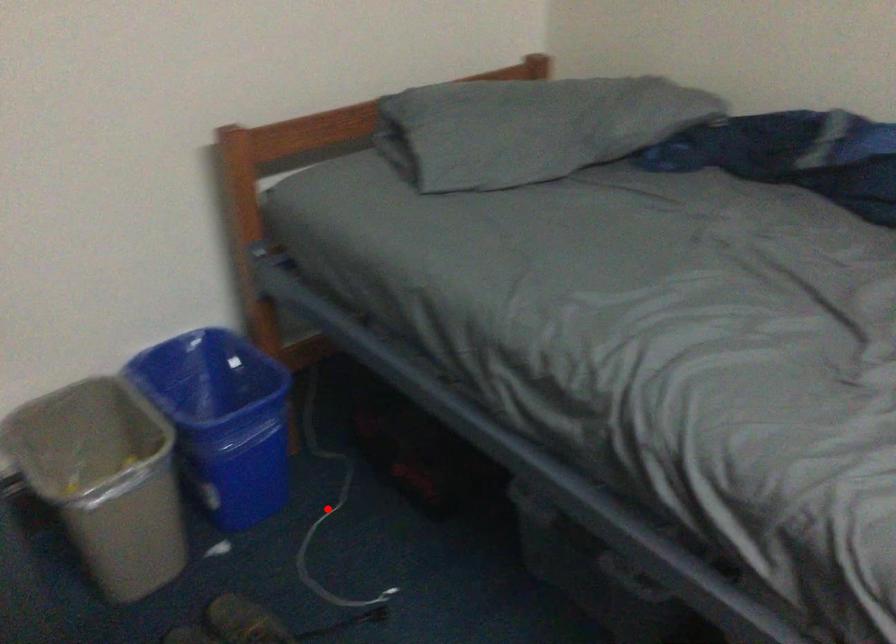
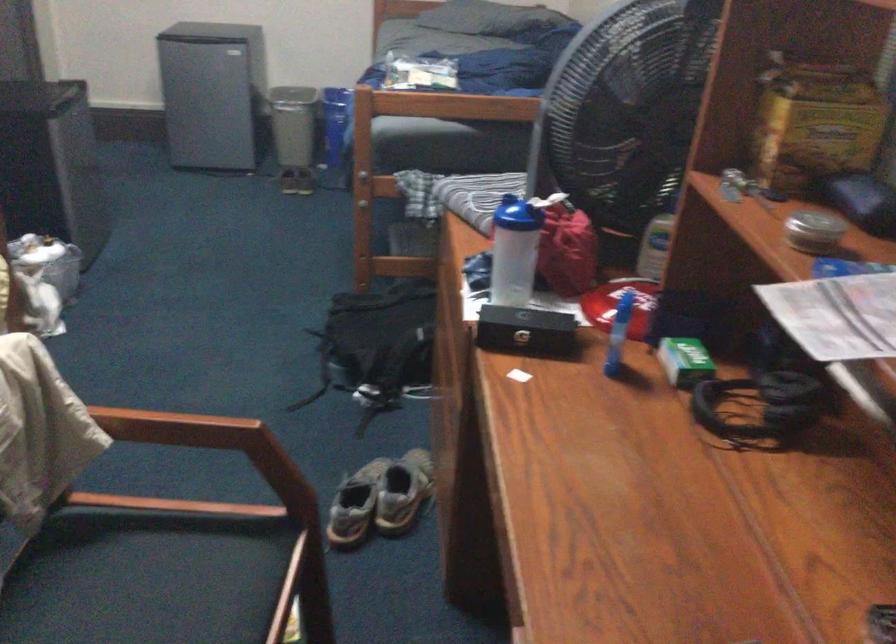
Question: I am providing you with two images of the same scene from different viewpoints. A red point is marked on the first image. Is the red point's position out of view in image 2?

Choices:
 (A) Yes
 (B) No

Answer: (A)